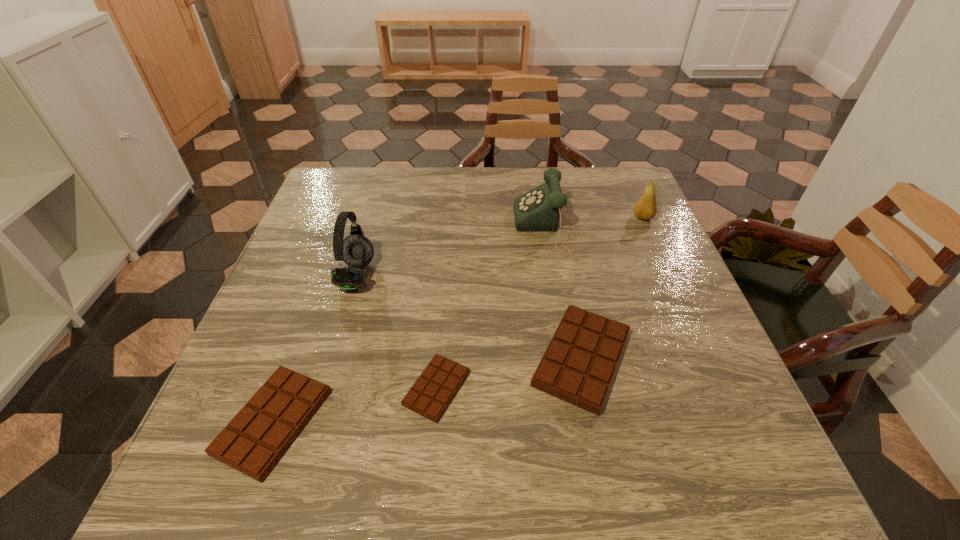
The width and height of the screenshot is (960, 540). Identify the location of vacant space in between the telephone and the second candy bar from right to left. (492, 308).

This screenshot has width=960, height=540. What are the coordinates of `vacant space in between the rightmost candy bar and the pear` in the screenshot? It's located at (612, 288).

Identify the location of free spot between the leftmost candy bar and the pear. (458, 320).

Find the location of a particular element. vacant area that lies between the rightmost object and the rightmost candy bar is located at coordinates [612, 288].

Locate an element on the screen. The height and width of the screenshot is (540, 960). vacant region between the shortest candy bar and the tallest object is located at coordinates point(396,332).

In order to click on unoccupied position between the shortest candy bar and the telephone in this screenshot , I will do `click(492, 308)`.

Where is `unoccupied position between the telephone and the pear`? The image size is (960, 540). unoccupied position between the telephone and the pear is located at coordinates (594, 222).

What are the coordinates of `vacant region between the headset and the fourth object from right to left` in the screenshot? It's located at (396, 332).

Where is `the second closest object relative to the second tallest candy bar`? the second closest object relative to the second tallest candy bar is located at coordinates (356, 250).

Locate an element on the screen. The image size is (960, 540). the third closest object to the shortest object is located at coordinates (356, 250).